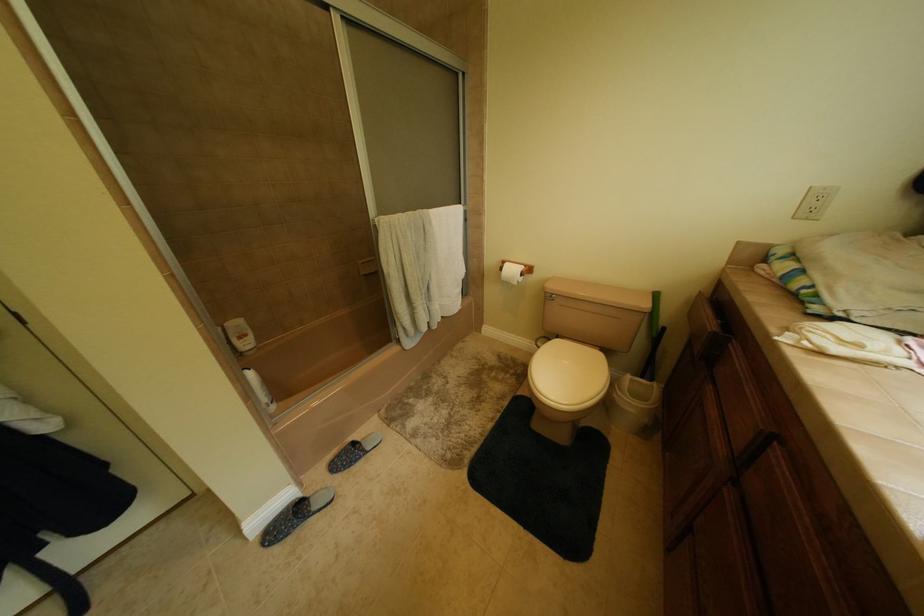
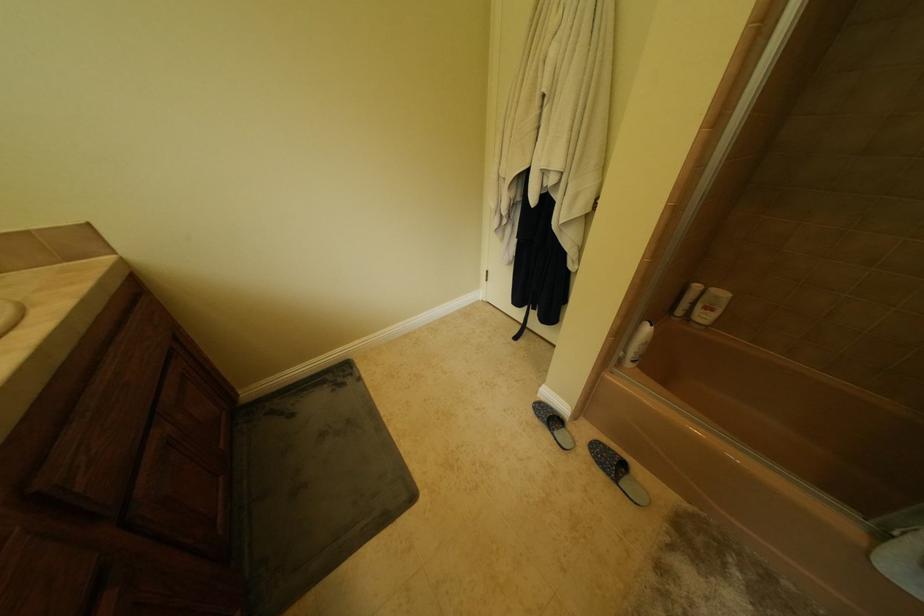
First-person continuous shooting, in which direction is the camera rotating?

The camera rotated toward left-down.